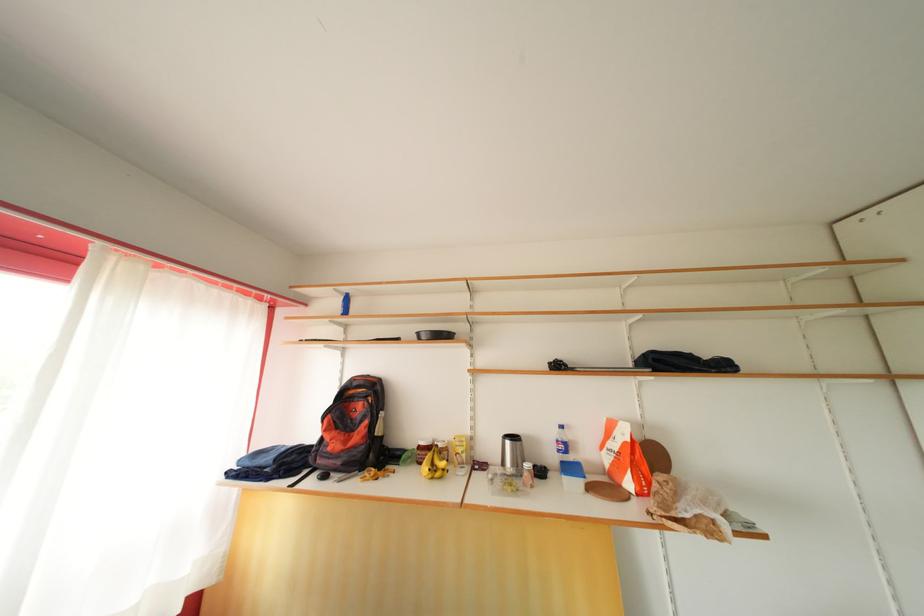
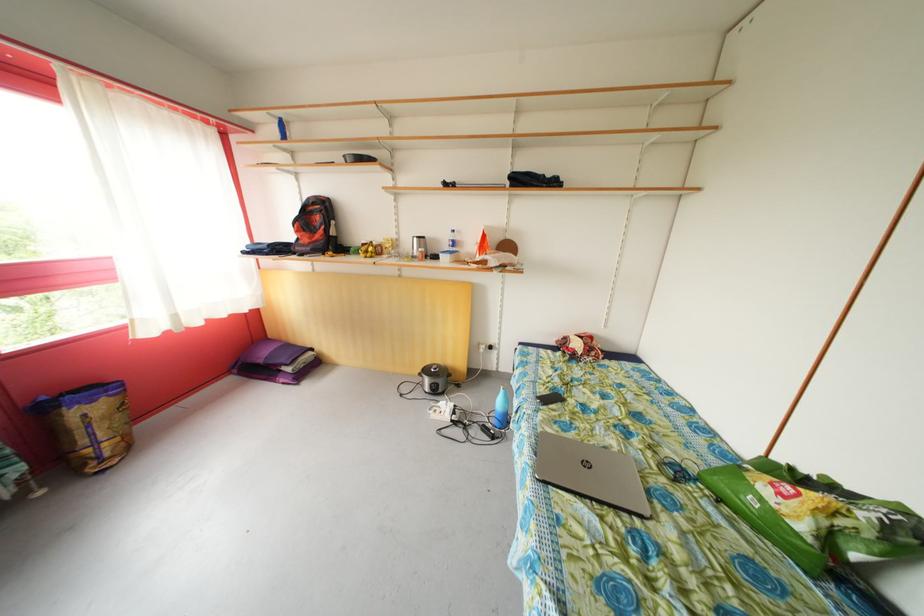
Question: The first image is from the beginning of the video and the second image is from the end. How did the camera likely rotate when shooting the video?

Choices:
 (A) Left
 (B) Right
 (C) Up
 (D) Down

Answer: (D)